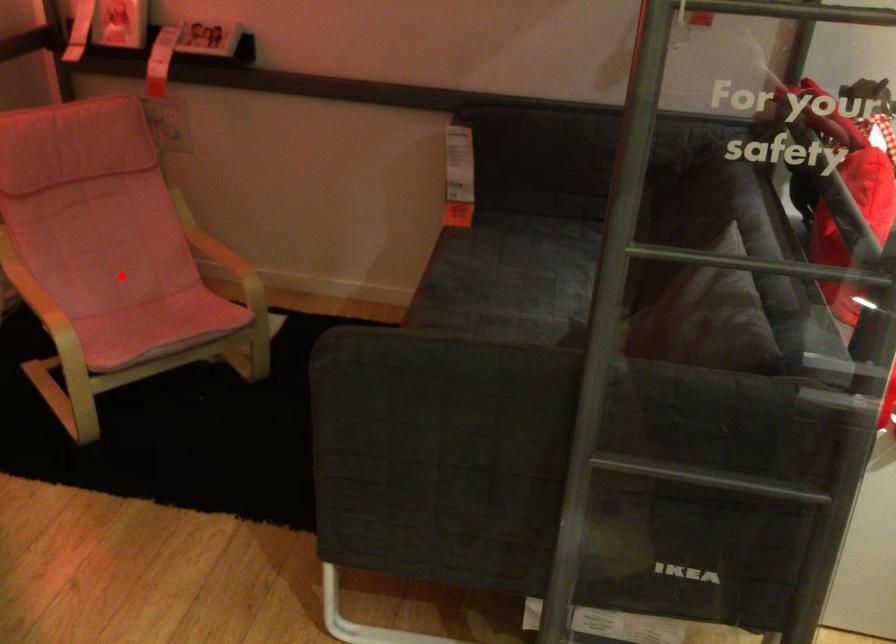
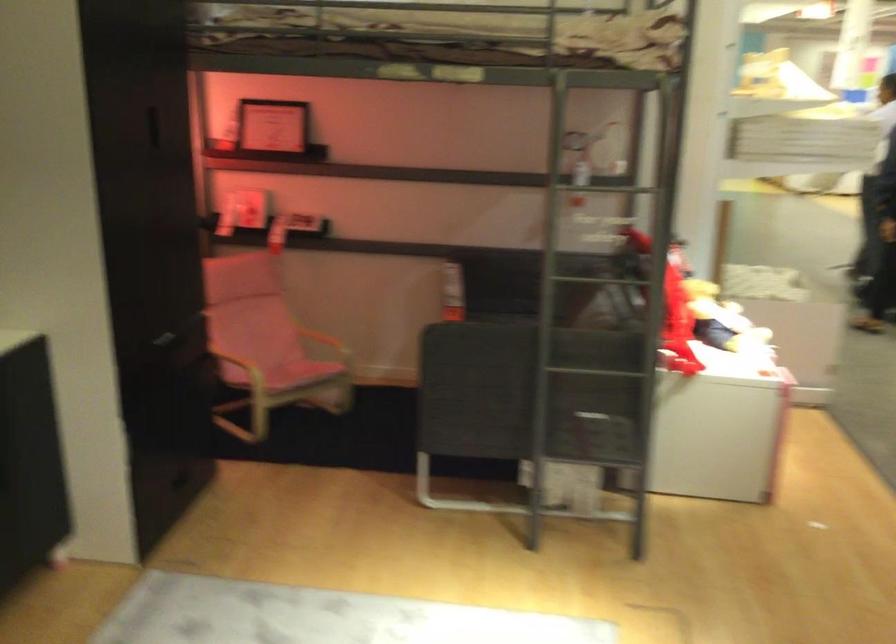
Question: I am providing you with two images of the same scene from different viewpoints. Given a red point in image1, look at the same physical point in image2. Is it:

Choices:
 (A) Closer to the viewpoint
 (B) Farther from the viewpoint

Answer: (B)